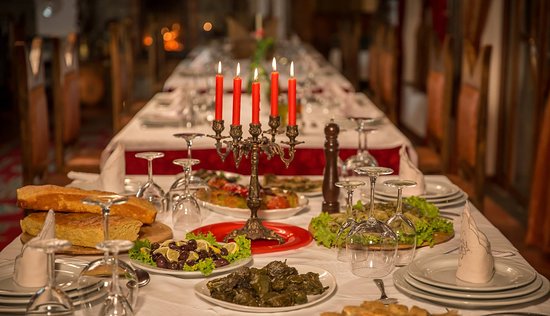
Locate an element on the screen. white dish is located at coordinates (230, 210).